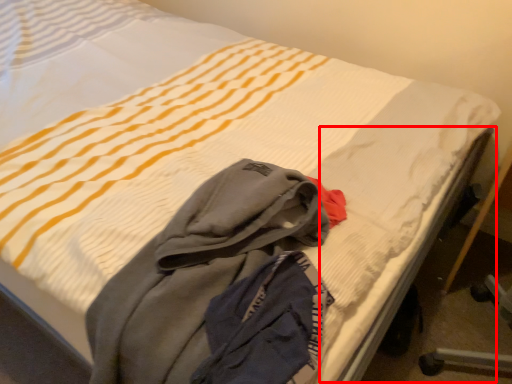
Question: From the image's perspective, where is bed frame (annotated by the red box) located in relation to laundry in the image?

Choices:
 (A) above
 (B) below

Answer: (A)